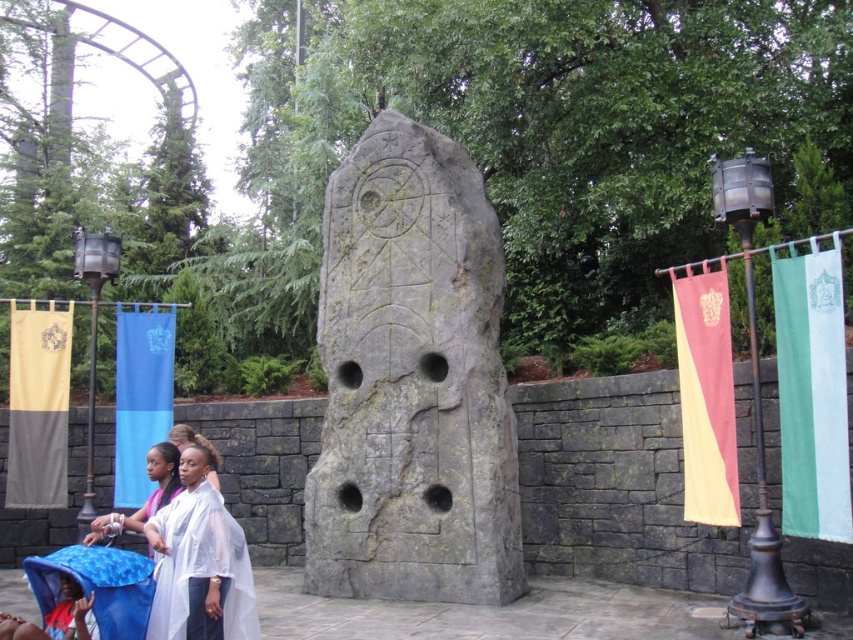
Question: Which object is positioned closest to the smooth white robe at center?

Choices:
 (A) blue fabric baby carriage at lower left
 (B) blue fabric banner at left

Answer: (A)

Question: Can you confirm if gray stone carving at center is smaller than gold fabric banner at left?

Choices:
 (A) no
 (B) yes

Answer: (A)

Question: Does white sheer fabric at lower left lie behind smooth white robe at center?

Choices:
 (A) yes
 (B) no

Answer: (B)

Question: Is white sheer fabric at lower left smaller than smooth white robe at center?

Choices:
 (A) no
 (B) yes

Answer: (A)

Question: Which point appears closest to the camera in this image?

Choices:
 (A) (165, 461)
 (B) (173, 612)

Answer: (B)

Question: Which point appears closest to the camera in this image?

Choices:
 (A) (178, 481)
 (B) (161, 316)
 (C) (167, 532)
 (D) (428, 573)

Answer: (C)